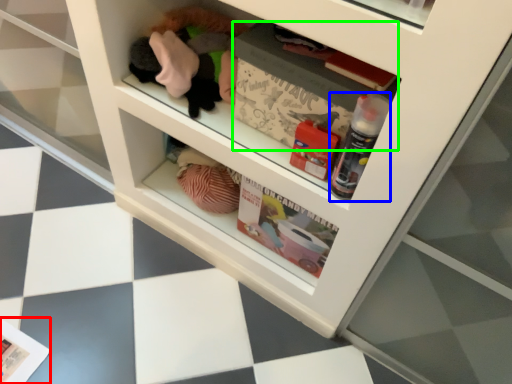
Question: Which is nearer to the magazine (highlighted by a red box)? bottle (highlighted by a blue box) or magazine (highlighted by a green box).

Choices:
 (A) bottle
 (B) magazine

Answer: (B)